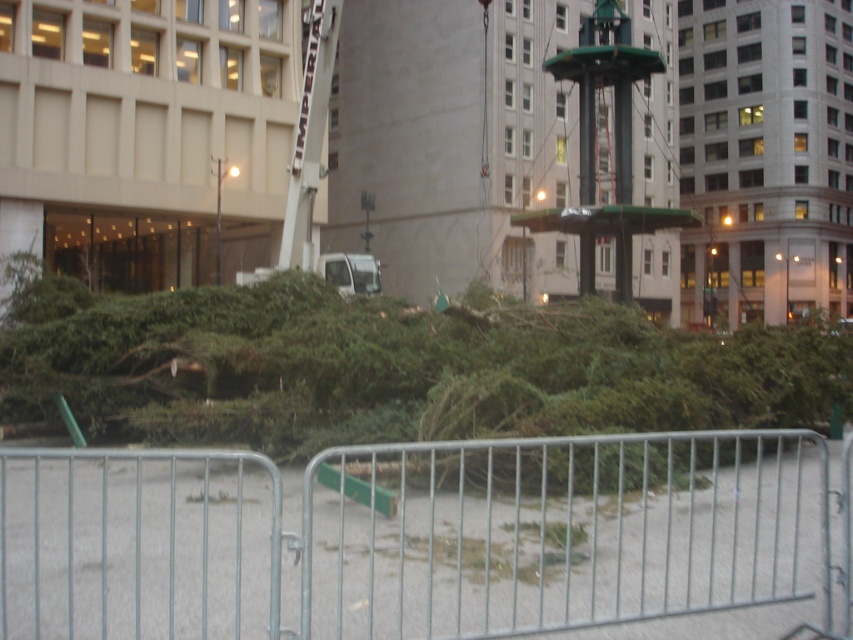
You are a city planner assessing the urban scene. You need to determine if the metal at center can be moved to accommodate the green leafy tree at center. Based on their sizes, is this feasible?

The metal at center occupies less space than the green leafy tree at center, so moving the metal at center would free up enough space to accommodate the green leafy tree at center.

You are a delivery driver trying to navigate through the metal at center and the green leafy tree at center in the urban scene. Which object should you avoid to stay on the correct path?

The metal at center is closer to you than the green leafy tree at center, so you should avoid the metal at center to stay on the correct path.

You are a city planner reviewing a map of the urban area. You see a point marked at coordinates (416, 536). What is located at this point?

The point at coordinates (416, 536) indicates metal at center.